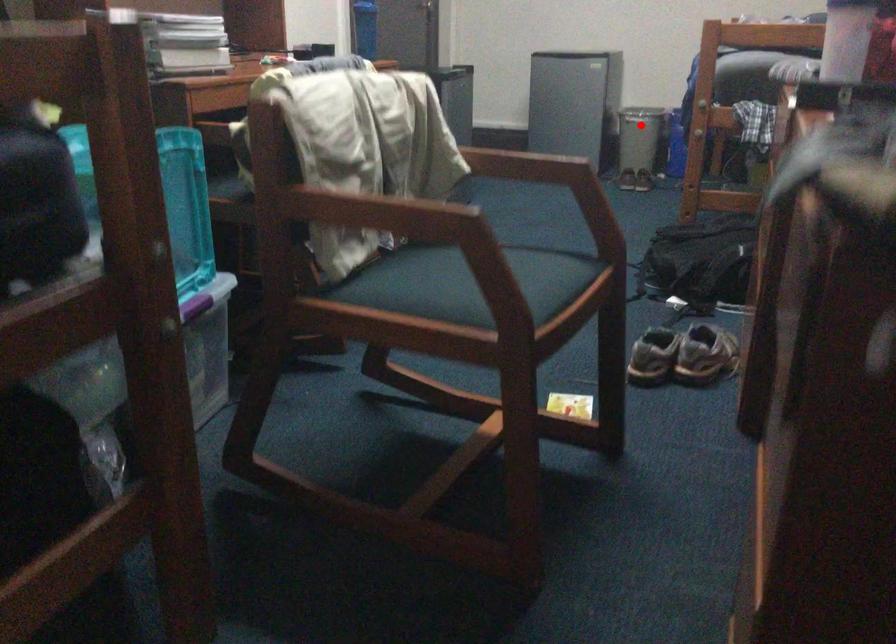
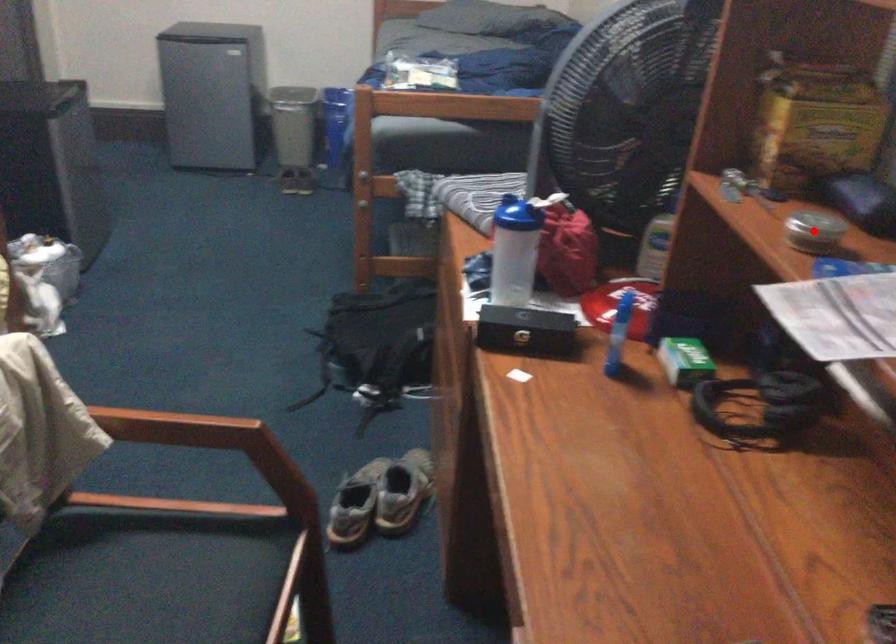
I am providing you with two images of the same scene from different viewpoints. A red point is marked on the first image and another point is marked on the second image. Is the marked point in image1 the same physical position as the marked point in image2?

No